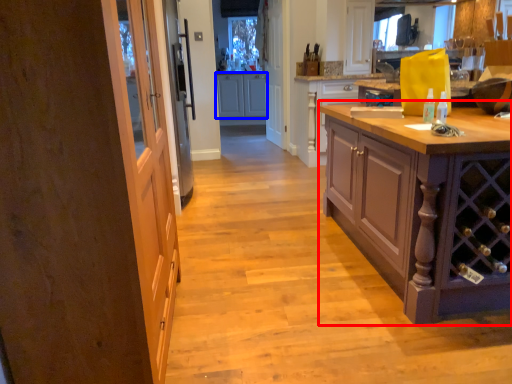
Question: Which object appears farthest to the camera in this image, cabinetry (highlighted by a red box) or cabinetry (highlighted by a blue box)?

Choices:
 (A) cabinetry
 (B) cabinetry

Answer: (B)